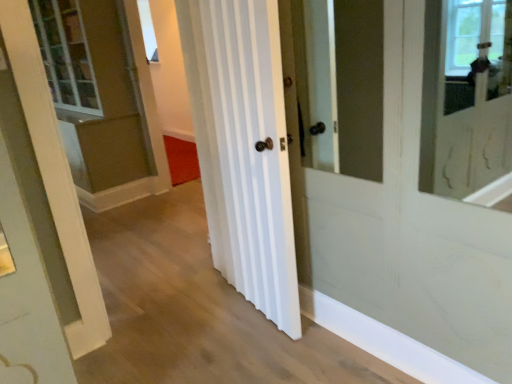
Describe the element at coordinates (148, 31) in the screenshot. This screenshot has width=512, height=384. I see `clear glass window at upper center` at that location.

Identify the location of clear glass window at upper center. (148, 31).

Image resolution: width=512 pixels, height=384 pixels. What do you see at coordinates (244, 149) in the screenshot?
I see `white striped door at center` at bounding box center [244, 149].

This screenshot has height=384, width=512. Find the location of `white striped door at center`. white striped door at center is located at coordinates (244, 149).

What is the approximate width of white striped door at center?

white striped door at center is 7.27 inches in width.

I want to click on clear glass window at upper center, so click(148, 31).

Can you confirm if clear glass window at upper center is positioned to the left of white striped door at center?

Yes, clear glass window at upper center is to the left of white striped door at center.

Which object is closer to the camera, clear glass window at upper center or white striped door at center?

white striped door at center is closer to the camera.

Which point is more distant from viewer, (x=152, y=53) or (x=289, y=212)?

Point (x=152, y=53)

From the image's perspective, is clear glass window at upper center located above or below white striped door at center?

clear glass window at upper center is situated higher than white striped door at center in the image.

From a real-world perspective, which object stands above the other?

From a 3D spatial view, clear glass window at upper center is above.

Can you confirm if clear glass window at upper center is thinner than white striped door at center?

Indeed, clear glass window at upper center has a lesser width compared to white striped door at center.

Considering the relative sizes of clear glass window at upper center and white striped door at center in the image provided, is clear glass window at upper center taller than white striped door at center?

In fact, clear glass window at upper center may be shorter than white striped door at center.

Does clear glass window at upper center have a smaller size compared to white striped door at center?

Yes.

Is clear glass window at upper center spatially inside white striped door at center, or outside of it?

clear glass window at upper center lies outside white striped door at center.

Can you see clear glass window at upper center touching white striped door at center?

clear glass window at upper center is not next to white striped door at center, and they're not touching.

Is clear glass window at upper center oriented away from white striped door at center?

No, clear glass window at upper center is not facing away from white striped door at center.

Find the location of `curtain lying in front of the clear glass window at upper center`. curtain lying in front of the clear glass window at upper center is located at coordinates (244, 149).

In the scene shown: Is white striped door at center at the left side of clear glass window at upper center?

No, white striped door at center is not to the left of clear glass window at upper center.

Is white striped door at center closer to camera compared to clear glass window at upper center?

Yes, white striped door at center is in front of clear glass window at upper center.

Which is behind, point (233, 46) or point (148, 60)?

The point (148, 60) is more distant.

From the image's perspective, relative to clear glass window at upper center, is white striped door at center above or below?

Clearly, from the image's perspective, white striped door at center is below clear glass window at upper center.

From a real-world perspective, is white striped door at center located higher than clear glass window at upper center?

No, from a real-world perspective, white striped door at center is not over clear glass window at upper center

Considering the sizes of white striped door at center and clear glass window at upper center in the image, is white striped door at center wider or thinner than clear glass window at upper center?

Considering their sizes, white striped door at center looks broader than clear glass window at upper center.

Which of these two, white striped door at center or clear glass window at upper center, stands shorter?

Standing shorter between the two is clear glass window at upper center.

Is white striped door at center smaller than clear glass window at upper center?

No, white striped door at center is not smaller than clear glass window at upper center.

Is clear glass window at upper center surrounded by white striped door at center?

No, clear glass window at upper center is not surrounded by white striped door at center.

Is white striped door at center directly adjacent to clear glass window at upper center?

No, white striped door at center is not with clear glass window at upper center.

Is white striped door at center oriented towards clear glass window at upper center?

No.

This screenshot has width=512, height=384. In order to click on window behind the white striped door at center in this screenshot , I will do `click(148, 31)`.

Where is `window on the left of white striped door at center`? The image size is (512, 384). window on the left of white striped door at center is located at coordinates (148, 31).

Identify the location of curtain that is under the clear glass window at upper center (from a real-world perspective). (244, 149).